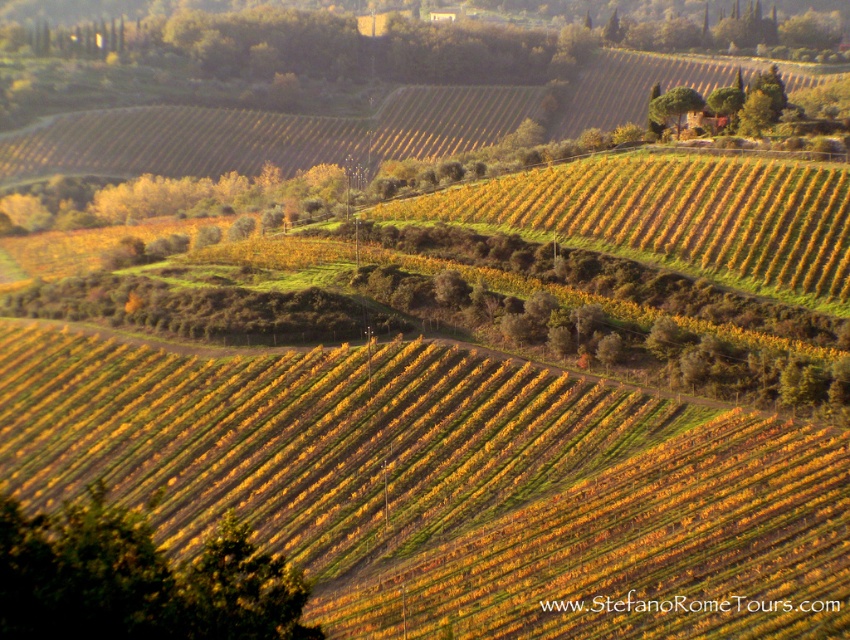
You are standing at the base of the vineyard looking towards the horizon. You see a green leafy tree at lower left and a green leafy tree at upper center. Which tree appears closer to you?

The green leafy tree at lower left is closer to you because it is positioned below the green leafy tree at upper center, which is further away in the scene.

You are standing in the vineyard and see the green leafy tree at lower left and the green leafy tree at upper center. Which tree is positioned more to the left side of the scene?

The green leafy tree at lower left is positioned more to the left side of the scene than the green leafy tree at upper center.